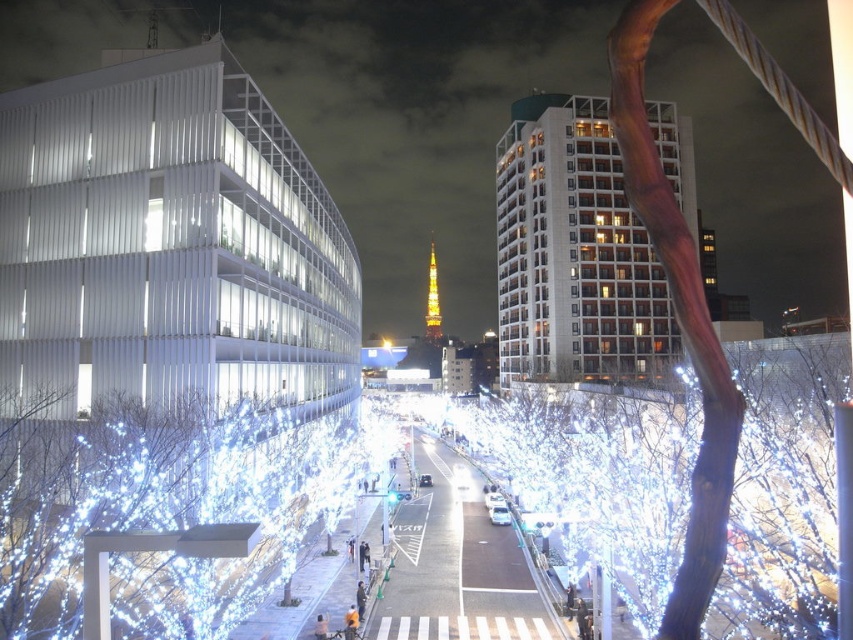
You are standing at the pedestrian crossing and want to reach the point marked at coordinates (485, 416). Given that your walking speed is 3 feet per second, how many seconds will it take you to reach that point?

The point marked at coordinates (485, 416) is 478.57 feet away from the viewer. At a walking speed of 3 feet per second, it will take approximately 159.5 seconds to reach that point.

You are a pedestrian standing at the pedestrian crossing in the image. You notice two sets of illuminated white branches. Which one is taller between the illuminated white branches at center and the illuminated white branches at lower left?

The illuminated white branches at center is taller than the illuminated white branches at lower left according to the description.